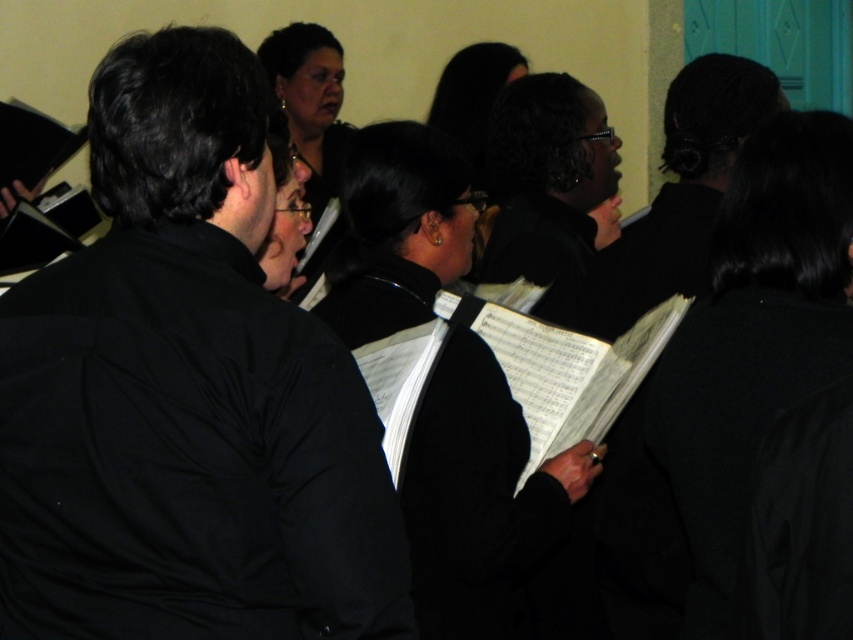
You are a photographer setting up for a choir rehearsal. You notice the black matte jacket at center and the black matte choir book at center. Which object should you adjust your camera focus to first if you want to capture both in the same frame without changing the zoom? Explain your reasoning based on their sizes.

The black matte jacket at center has a lesser height compared to the black matte choir book at center. Since the jacket is smaller, you should focus on the taller choir book first to ensure it fits within the frame, then adjust for the jacket.

You are a photographer setting up for a choir rehearsal. You notice the black matte choir book at center and the black glossy hair at upper center. Which object would require more space in your camera frame to capture its full size?

The black matte choir book at center is bigger than the black glossy hair at upper center, so it would require more space in the camera frame to capture its full size.

You are a photographer trying to capture a closeup of the black matte choir book at center without including the black matte jacket at center in the frame. Based on their sizes, is this possible?

The black matte jacket at center occupies less space than the black matte choir book at center, so it is possible to capture a closeup of the black matte choir book at center without including the black matte jacket at center in the frame since the jacket is smaller in size.